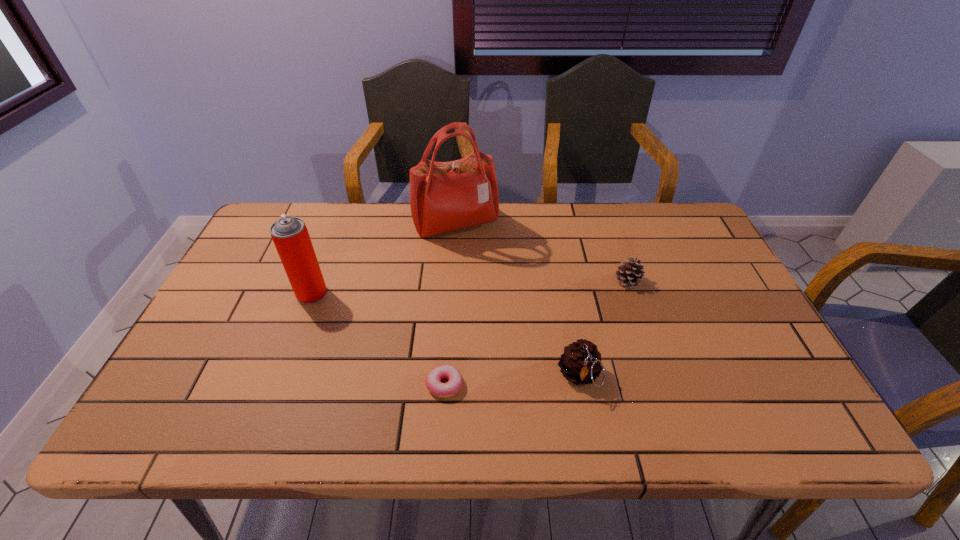
Where is `free space located on the right of the leftmost object`? This screenshot has height=540, width=960. free space located on the right of the leftmost object is located at coordinates (356, 293).

Find the location of a particular element. free space located with a leaf charm attached to the third shortest object is located at coordinates (589, 429).

The width and height of the screenshot is (960, 540). What are the coordinates of `free space located 0.270m on the front of the shorter pinecone` in the screenshot? It's located at (660, 376).

The width and height of the screenshot is (960, 540). Identify the location of vacant region located 0.280m on the right of the shortest object. (587, 384).

In order to click on object that is at the far edge in this screenshot , I will do `click(444, 196)`.

Where is `vacant space at the far edge of the desktop`? vacant space at the far edge of the desktop is located at coordinates (334, 207).

Image resolution: width=960 pixels, height=540 pixels. In the image, there is a desktop. Find the location of `vacant space at the near edge`. vacant space at the near edge is located at coordinates (552, 408).

In the image, there is a desktop. Find the location of `free space at the left edge`. free space at the left edge is located at coordinates (278, 275).

Identify the location of vacant region at the right edge of the desktop. (728, 312).

In order to click on vacant area at the far left corner of the desktop in this screenshot , I will do `click(283, 202)`.